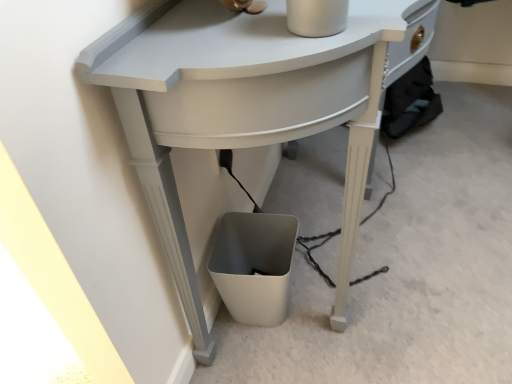
Find the location of a particular element. The height and width of the screenshot is (384, 512). matte white table at center is located at coordinates (245, 102).

The height and width of the screenshot is (384, 512). What do you see at coordinates (245, 102) in the screenshot?
I see `matte white table at center` at bounding box center [245, 102].

Find the location of a particular element. This screenshot has height=384, width=512. matte white table at center is located at coordinates (245, 102).